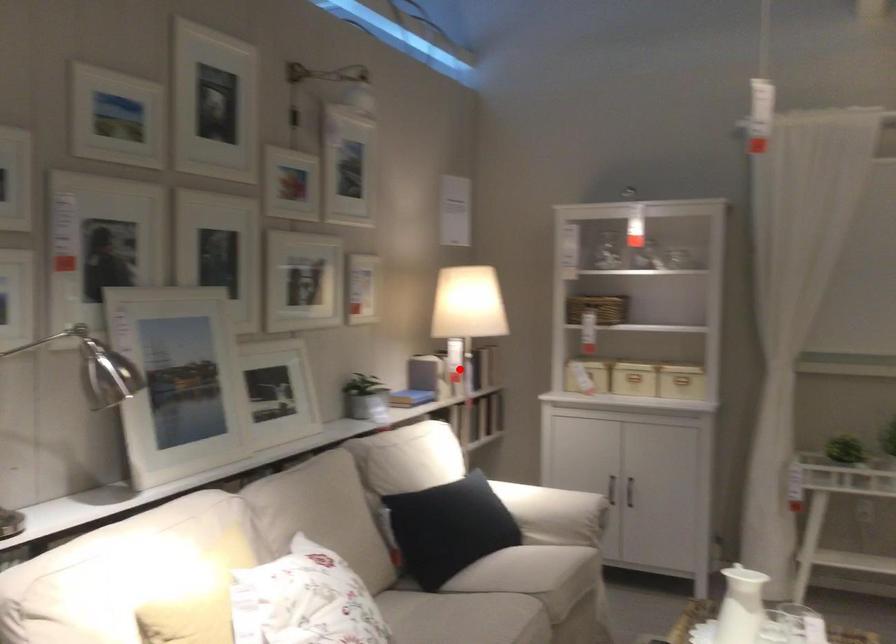
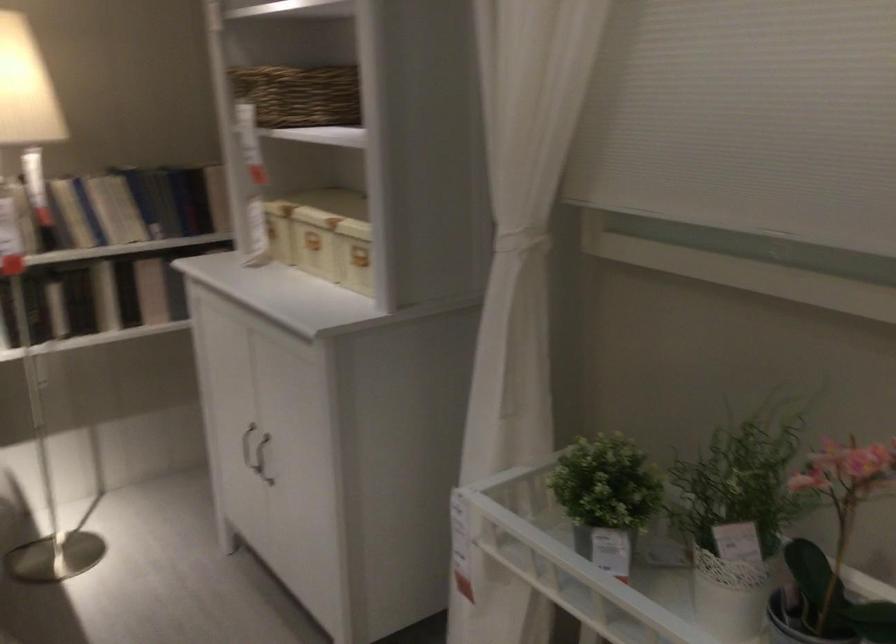
Locate, in the second image, the point that corresponds to the highlighted location in the first image.

(71, 213)